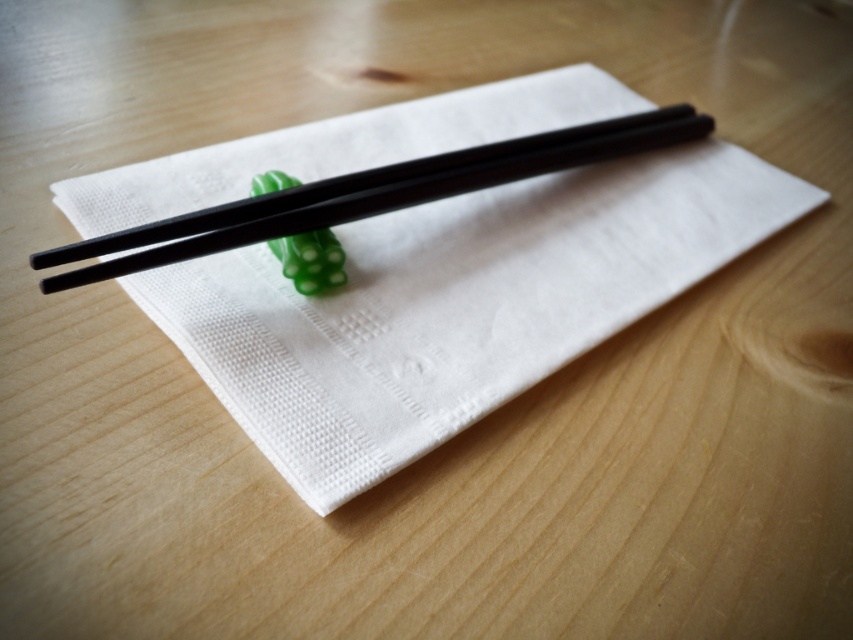
You are setting up a table for a small gathering and need to arrange the black glossy chopsticks at center and the green rubbery toy at center. According to the image, which object is placed higher on the table?

The black glossy chopsticks at center are placed higher than the green rubbery toy at center according to the image.

You are setting up a table for a small gathering. You have a black glossy chopsticks at center and a green rubbery toy at center. According to the scene, which item is closer to you when looking at the table?

The black glossy chopsticks at center are closer to you because they are positioned in front of the green rubbery toy at center in the scene.